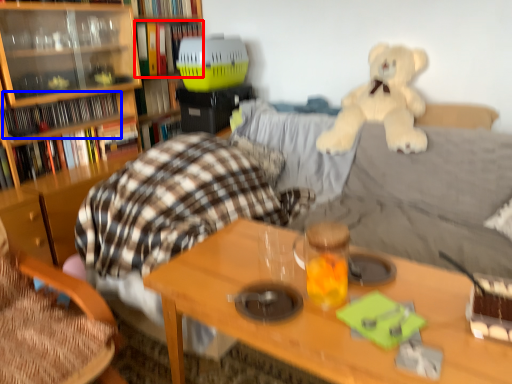
Question: Which of the following is the farthest to the observer, book (highlighted by a red box) or book (highlighted by a blue box)?

Choices:
 (A) book
 (B) book

Answer: (A)